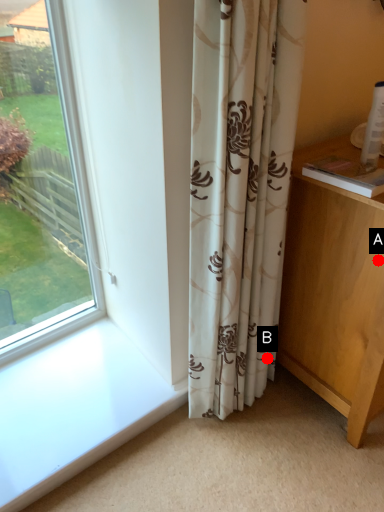
Question: Two points are circled on the image, labeled by A and B beside each circle. Which point is farther from the camera taking this photo?

Choices:
 (A) A is further
 (B) B is further

Answer: (B)